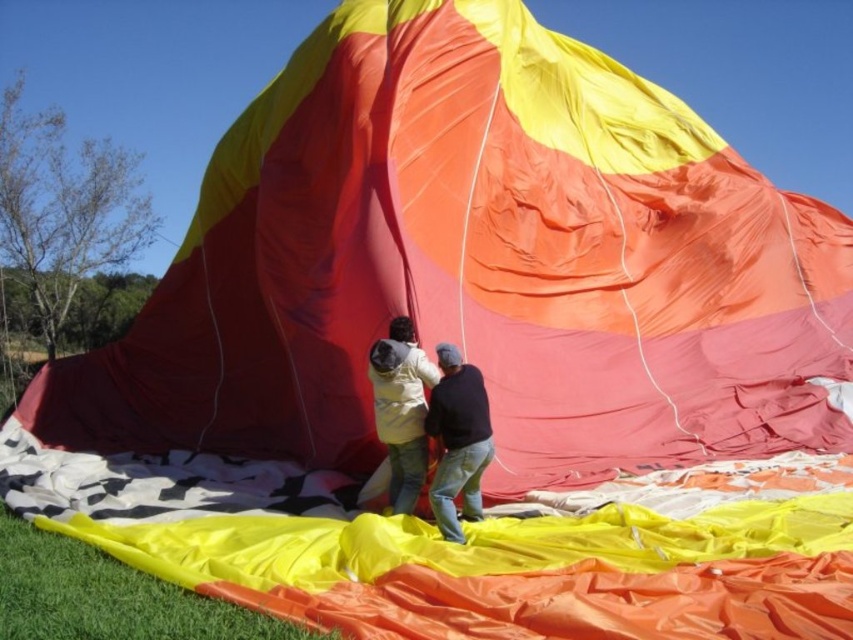
You are standing at the center of the hot air balloon and looking towards the direction where the two people are working. Which of the two points, point (444,358) or point (403,419), is closer to you?

Point (403,419) is closer to you because it is in front of point (444,358).

You are standing in front of the hot air balloon and want to hand a tool to both the black matte shirt at center and the matte yellow jacket at center. Which person should you give the tool to first based on their position?

You should give the tool to the black matte shirt at center first because they are closer to you than the matte yellow jacket at center.